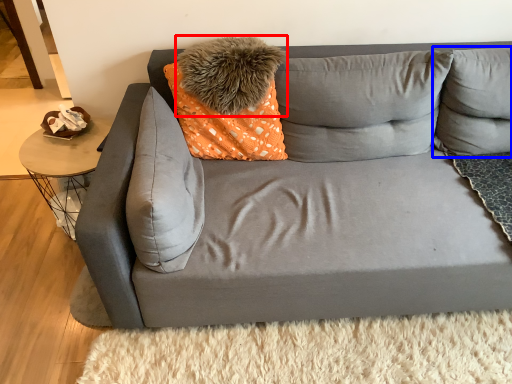
Question: Which object is closer to the camera taking this photo, pillow (highlighted by a red box) or pillow (highlighted by a blue box)?

Choices:
 (A) pillow
 (B) pillow

Answer: (B)